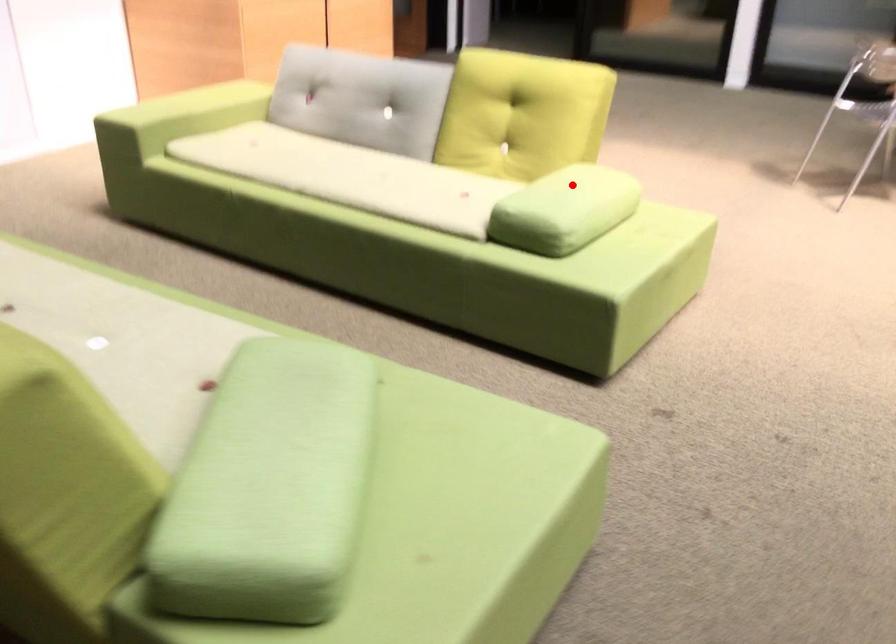
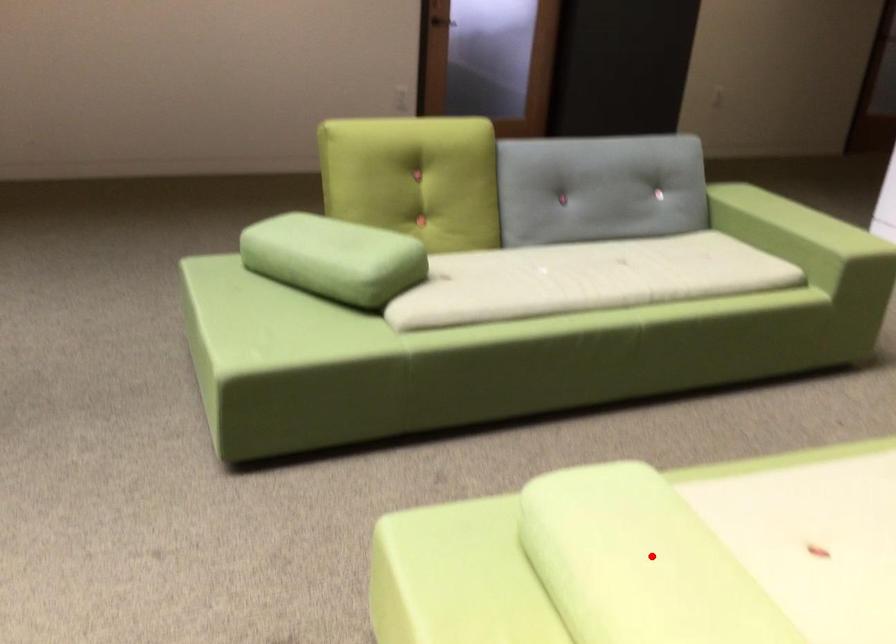
I am providing you with two images of the same scene from different viewpoints. A red point is marked on the first image and another point is marked on the second image. Do the highlighted points in image1 and image2 indicate the same real-world spot?

Yes